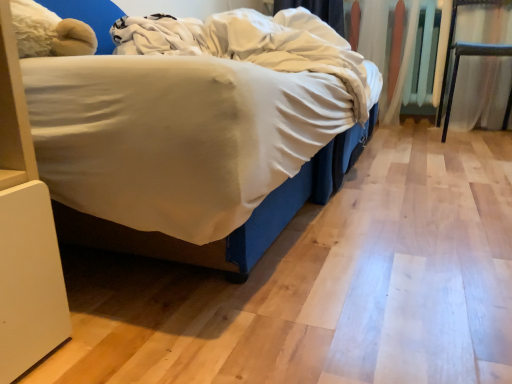
Identify the location of vacant position to the left of metallic silver chair at right. This screenshot has width=512, height=384. (412, 142).